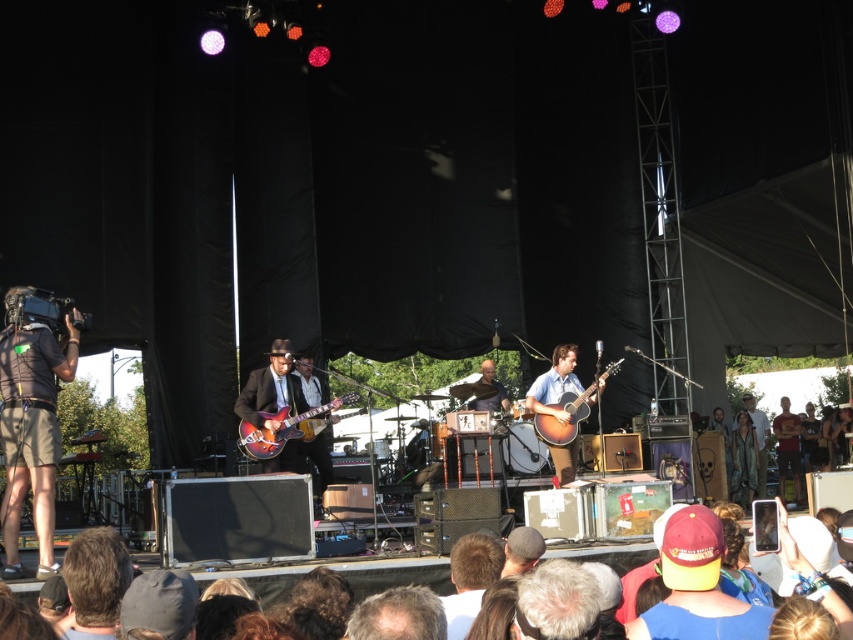
You are a photographer at the concert and want to take a closeup shot of the matte brown guitar at center without the maroon fabric cap at lower right blocking the view. Is the cap currently in front of the guitar, making it difficult to capture a clear shot?

The maroon fabric cap at lower right is in front of the matte brown guitar at center, so it is blocking the view and making it difficult to capture a clear shot of the matte brown guitar at center.

You are a photographer at the concert and want to capture a closeup of the maroon fabric cap at lower right and the matte brown guitar at center. Since your camera can only focus on one object at a time, which object should you choose to ensure it appears larger in the photo?

The maroon fabric cap at lower right should be chosen because its width is larger than the matte brown guitar at center, so it will appear larger in the photo.

You are a stagehand at the concert venue. You need to place a protective cover over the acoustic wood guitar at center and the light brown leather jacket at center. The cover you have is 1 meter wide. Will it fit both items without overlapping?

The acoustic wood guitar at center is narrower than the light brown leather jacket at center. Since the total width of both items combined would exceed the cover width of 1 meter, the cover may not fit both without overlapping. However, if placed individually, the cover can accommodate each item separately.